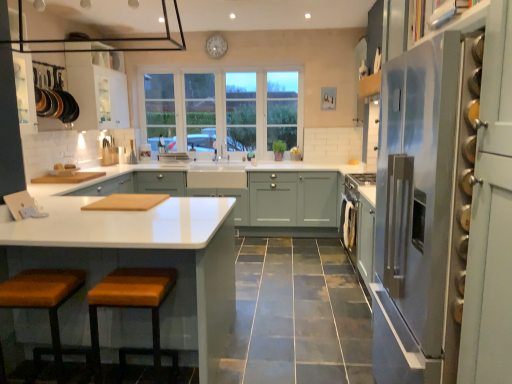
You are a GUI agent. You are given a task and a screenshot of the screen. Output one action in this format:
    pyautogui.click(x=<x>, y=<y>)
    Task: Click on the vacant space situated above white glossy countertop at center, the second cabinetry in the back-to-front sequence (from a real-world perspective)
    The width and height of the screenshot is (512, 384).
    Given the screenshot: What is the action you would take?
    pyautogui.click(x=108, y=210)